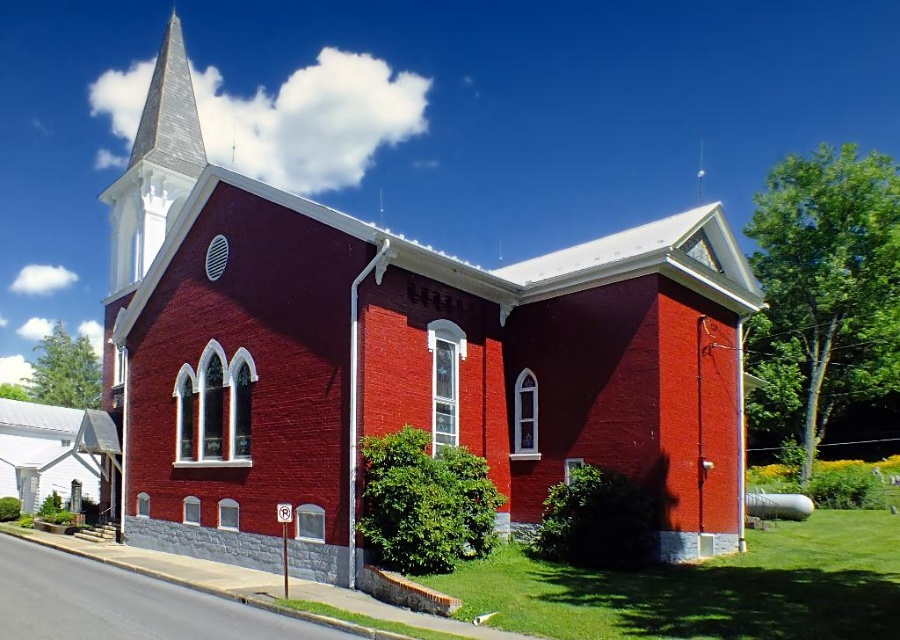
Question: Which object is farther from the camera taking this photo?

Choices:
 (A) white steeple at upper left
 (B) brick church at center

Answer: (A)

Question: Considering the relative positions of brick church at center and white steeple at upper left in the image provided, where is brick church at center located with respect to white steeple at upper left?

Choices:
 (A) below
 (B) above

Answer: (A)

Question: Which point is closer to the camera?

Choices:
 (A) white steeple at upper left
 (B) brick church at center

Answer: (B)

Question: Does brick church at center appear on the left side of white steeple at upper left?

Choices:
 (A) yes
 (B) no

Answer: (B)

Question: Can you confirm if brick church at center is wider than white steeple at upper left?

Choices:
 (A) yes
 (B) no

Answer: (A)